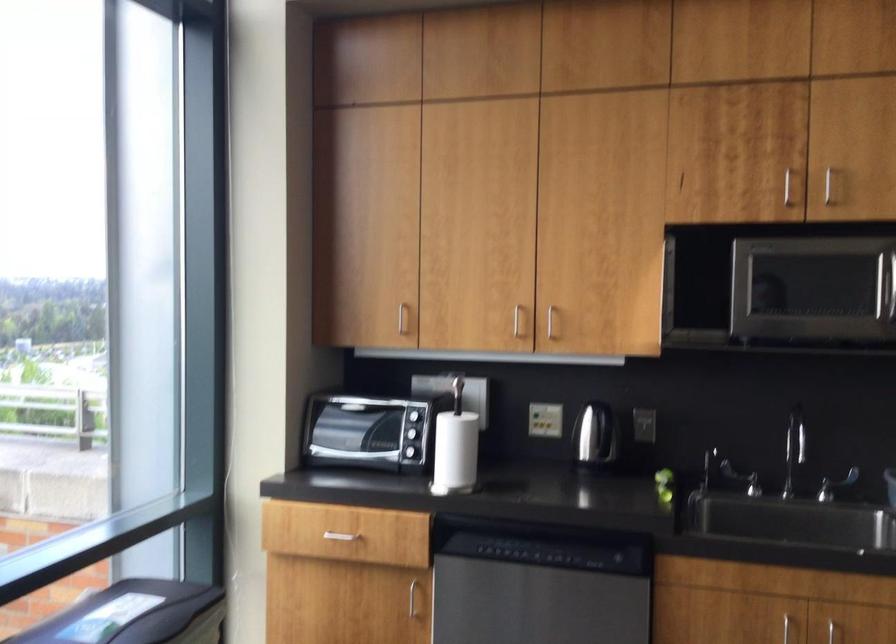
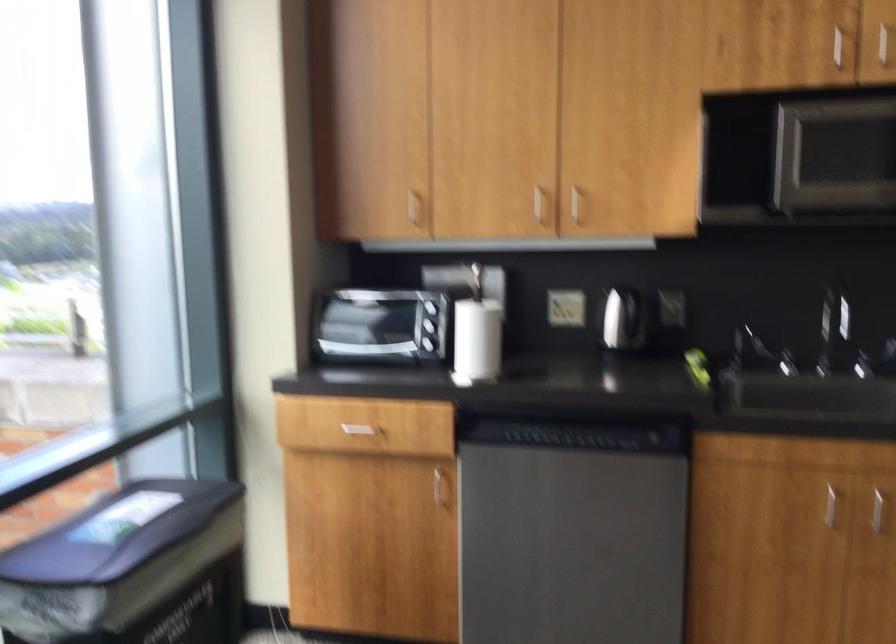
Question: The images are taken continuously from a first-person perspective. In which direction is your viewpoint rotating?

Choices:
 (A) Left
 (B) Right
 (C) Up
 (D) Down

Answer: (D)